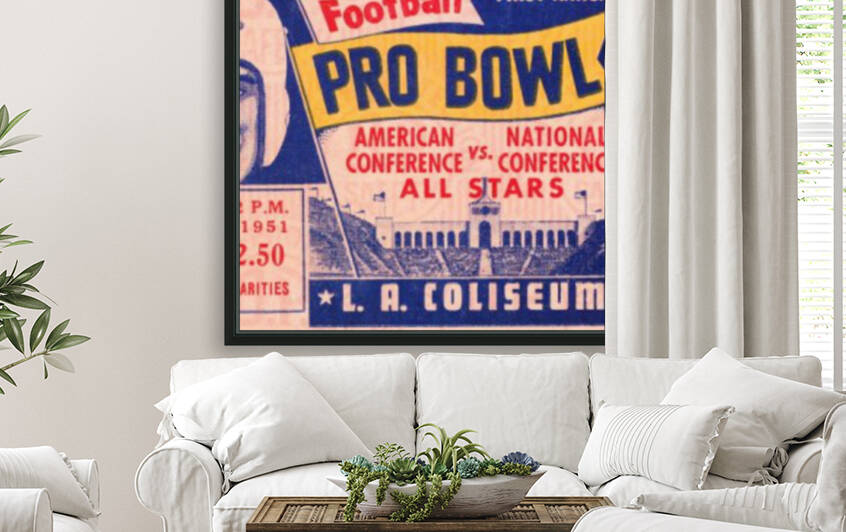
I want to click on picture frame, so click(x=228, y=304), click(x=360, y=342), click(x=233, y=39).